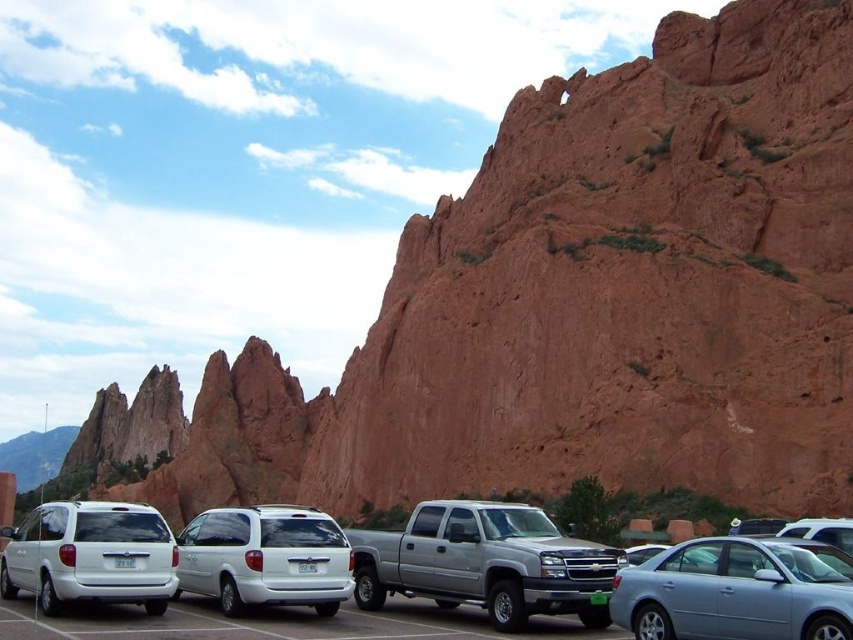
Question: Which point is closer to the camera taking this photo?

Choices:
 (A) (141, 568)
 (B) (299, 637)
 (C) (577, 568)

Answer: (B)

Question: Can you confirm if satin silver sedan at lower right is smaller than white matte suv at center?

Choices:
 (A) no
 (B) yes

Answer: (B)

Question: Can you confirm if white matte van at center is bigger than white matte suv at center?

Choices:
 (A) no
 (B) yes

Answer: (B)

Question: Which object is the farthest from the satin silver sedan at lower right?

Choices:
 (A) silver metallic truck at center
 (B) white matte van at lower left
 (C) white matte van at center
 (D) white matte suv at center

Answer: (B)

Question: Which object is positioned farthest from the white matte van at center?

Choices:
 (A) white matte van at lower left
 (B) white matte suv at center
 (C) silver metallic truck at center
 (D) satin silver sedan at lower right

Answer: (D)

Question: Does silver metallic truck at center have a smaller size compared to white matte van at center?

Choices:
 (A) yes
 (B) no

Answer: (B)